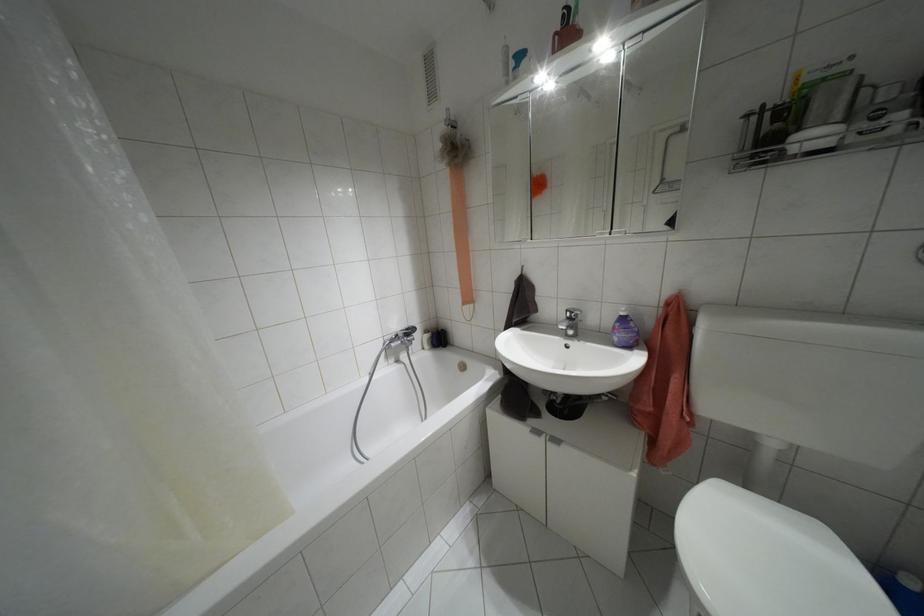
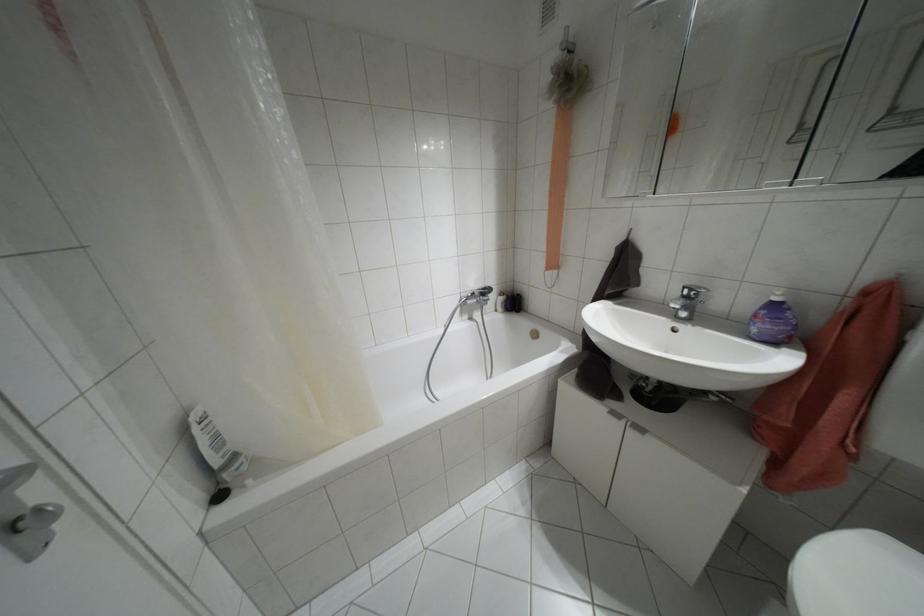
Question: The camera is either moving clockwise (left) or counter-clockwise (right) around the object. The first image is from the beginning of the video and the second image is from the end. Is the camera moving left or right when shooting the video?

Choices:
 (A) Left
 (B) Right

Answer: (B)